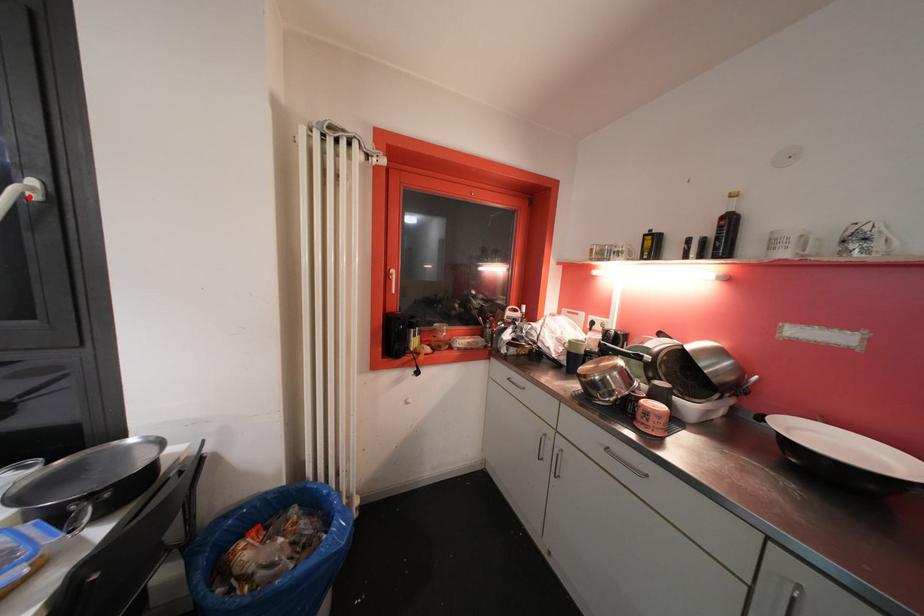
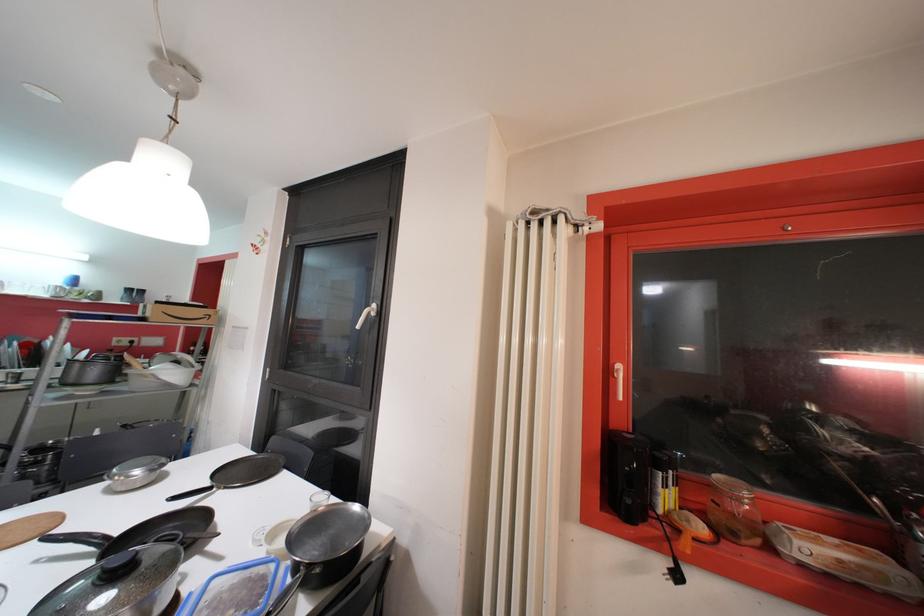
Question: I am providing you with two images of the same scene from different viewpoints. Given a red point in image1, look at the same physical point in image2. Is it:

Choices:
 (A) Closer to the viewpoint
 (B) Farther from the viewpoint

Answer: (A)